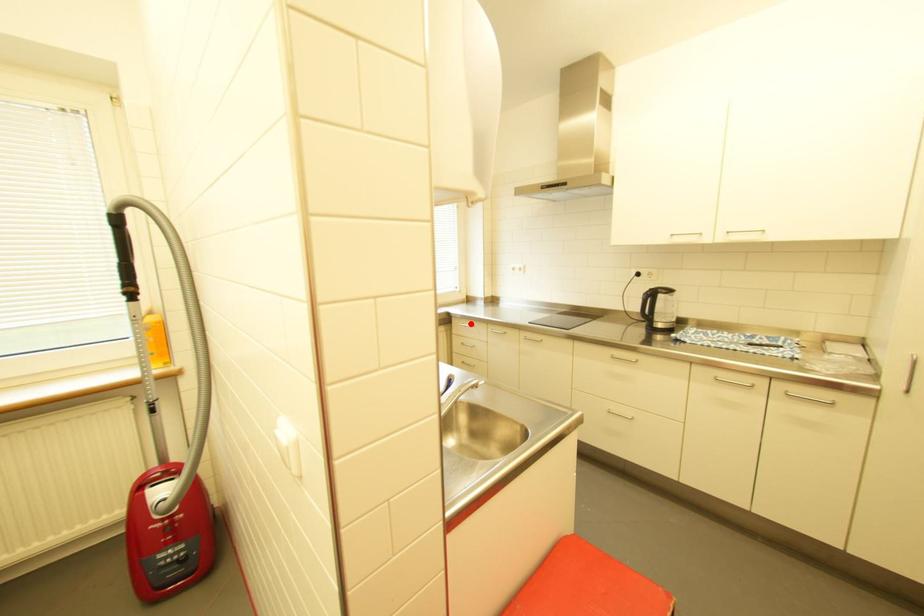
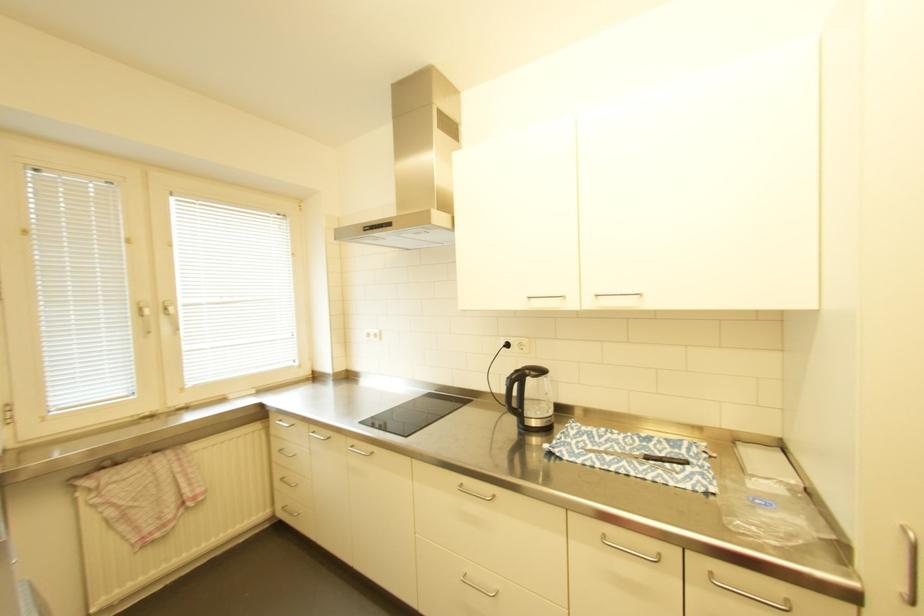
Where in the second image is the point corresponding to the highlighted location from the first image?

(287, 421)